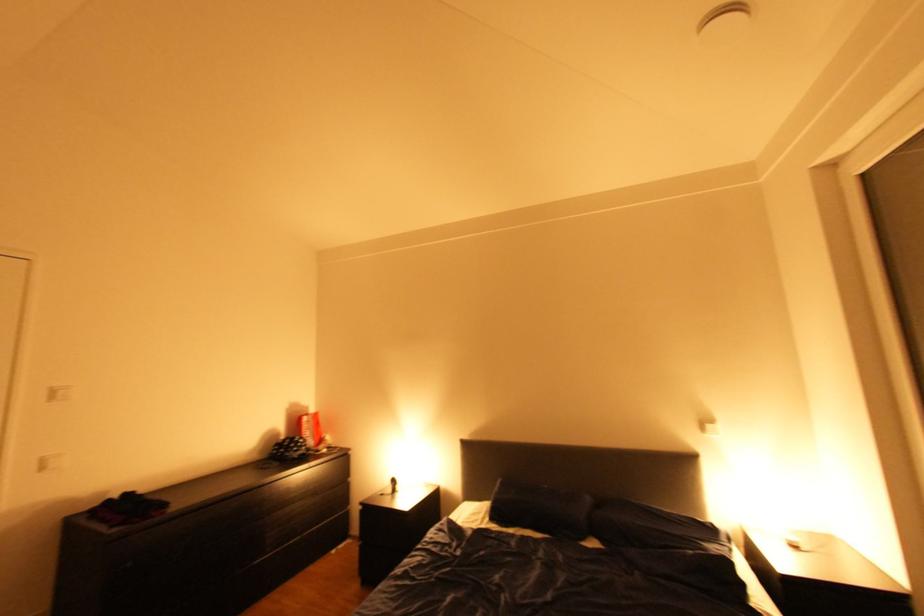
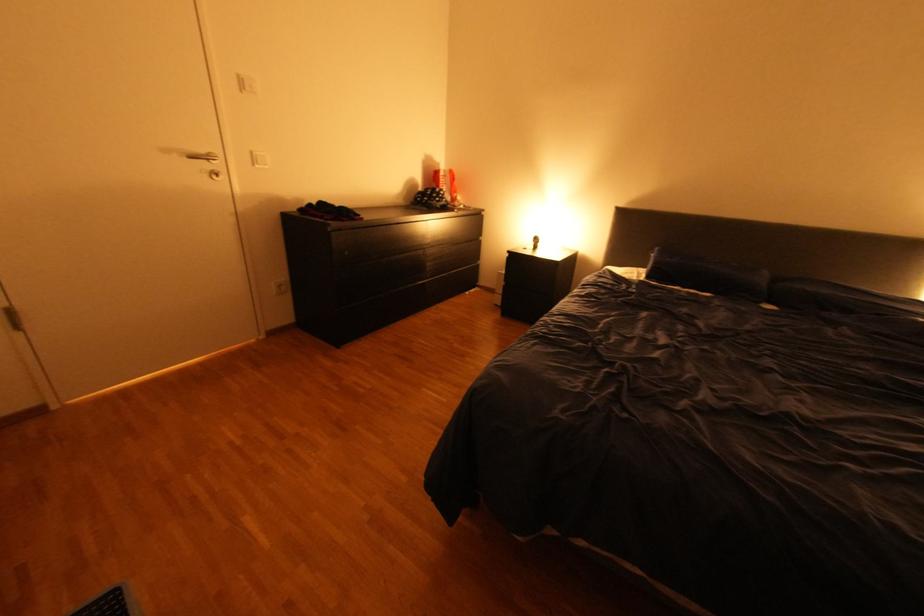
Question: The images are taken continuously from a first-person perspective. In which direction is your viewpoint rotating?

Choices:
 (A) Left
 (B) Right
 (C) Up
 (D) Down

Answer: (D)